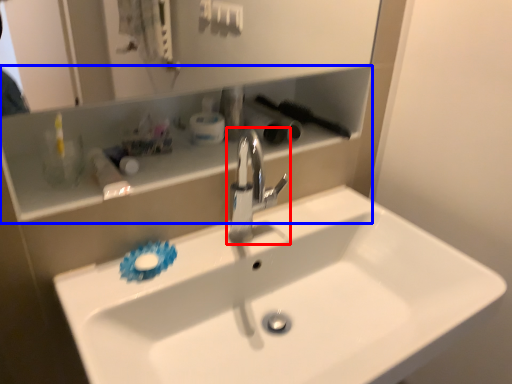
Question: Which object appears farthest to the camera in this image, tap (highlighted by a red box) or shelve (highlighted by a blue box)?

Choices:
 (A) tap
 (B) shelve

Answer: (A)